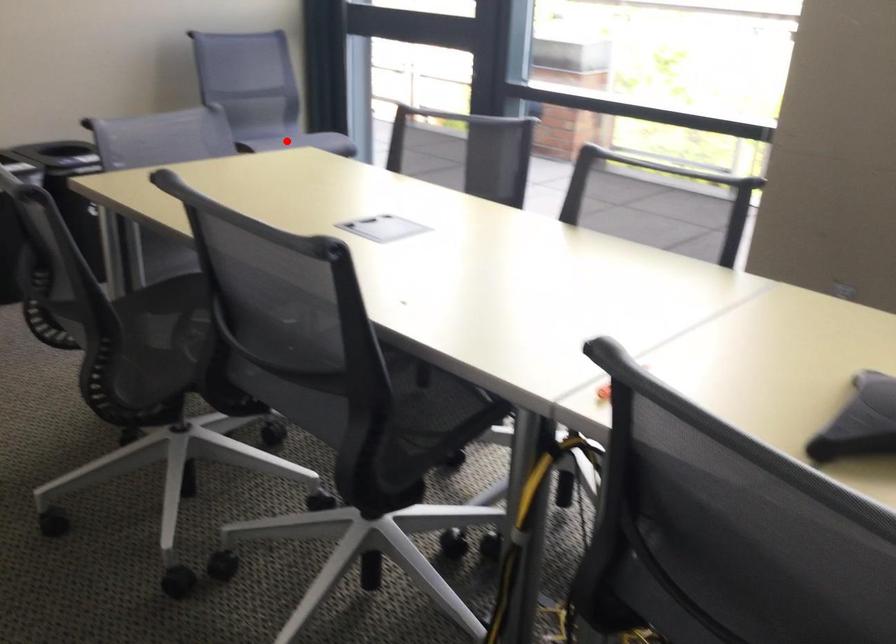
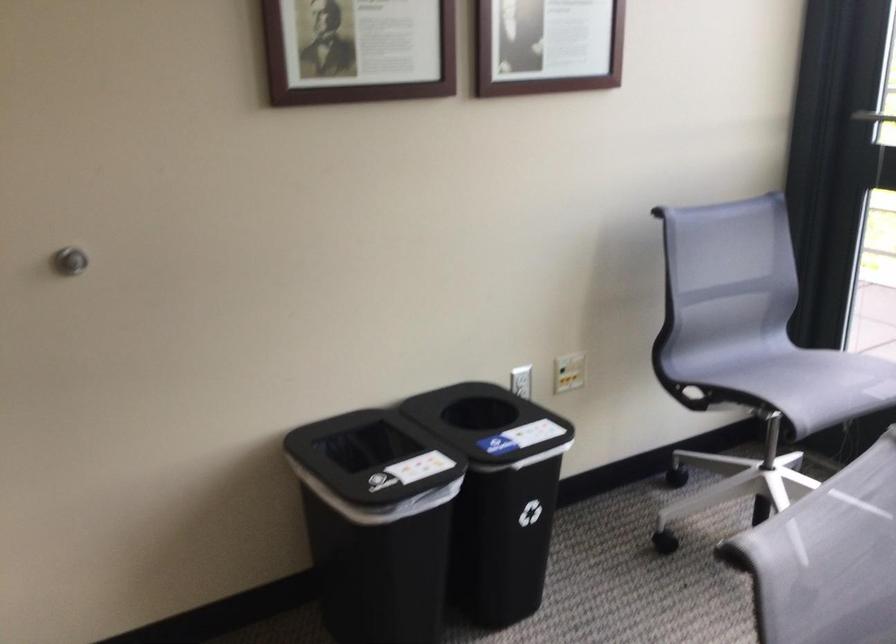
Question: I am providing you with two images of the same scene from different viewpoints. Given a red point in image1, look at the same physical point in image2. Is it:

Choices:
 (A) Closer to the viewpoint
 (B) Farther from the viewpoint

Answer: (A)